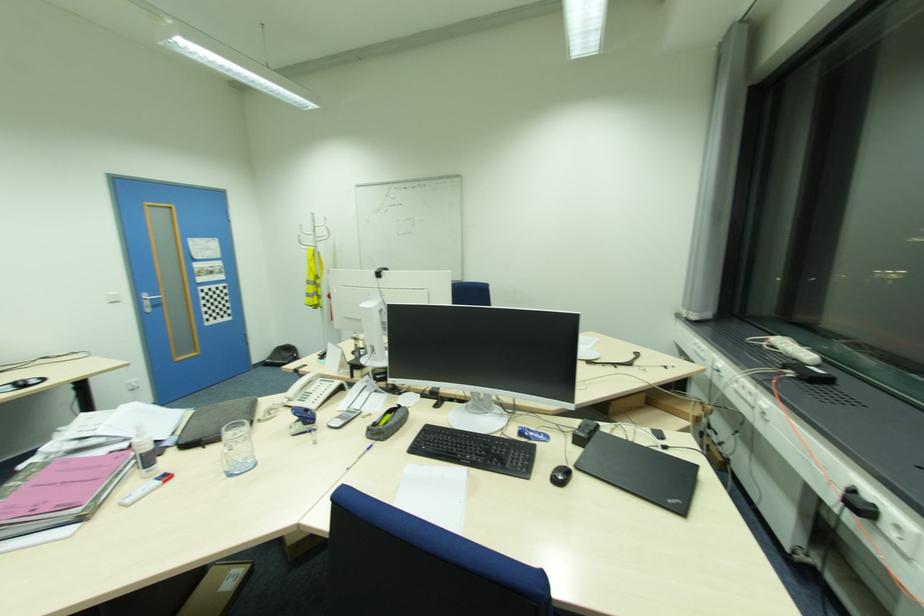
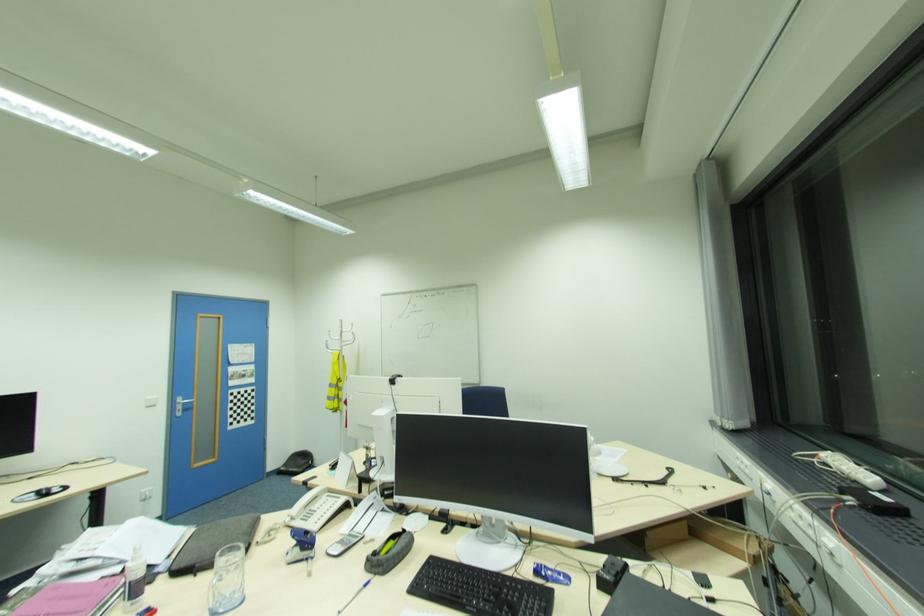
In the second image, find the point that corresponds to the point at 231,429 in the first image.

(225, 554)